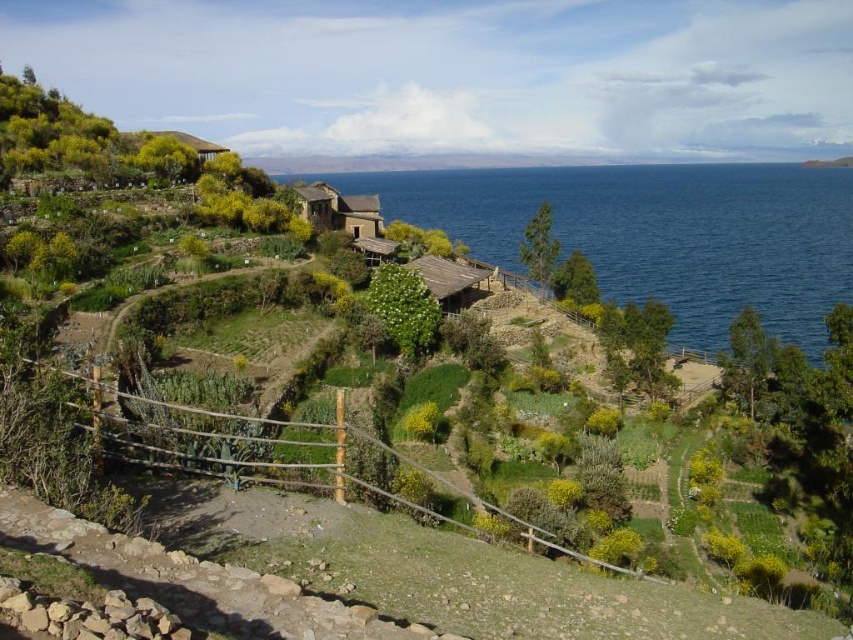
You are a hiker standing on the stone pathway in the foreground of the scene. You want to visit both the rustic stone hut at center and the wooden hut at upper left. Which hut should you head towards if you want to visit the one that is located to the right first?

You should visit the rustic stone hut at center first because it is located to the right of the wooden hut at upper left, so if you want to visit the one to the right first, start with the rustic stone hut at center.

You are a tourist visiting the terraced hillside and want to take a photo that includes both the rustic stone hut at center and the wooden hut at center. Which of the two huts should you position closer to the camera to ensure both are fully visible in the frame?

The rustic stone hut at center is larger in size than the wooden hut at center. To ensure both are fully visible, position the rustic stone hut at center closer to the camera since its larger size requires more space in the frame.

You are standing on the stone pathway and want to walk to the wooden hut at center. Which direction should you go relative to the rustic stone hut at center?

You should go behind the rustic stone hut at center to reach the wooden hut at center since the wooden hut is located behind it according to the description.